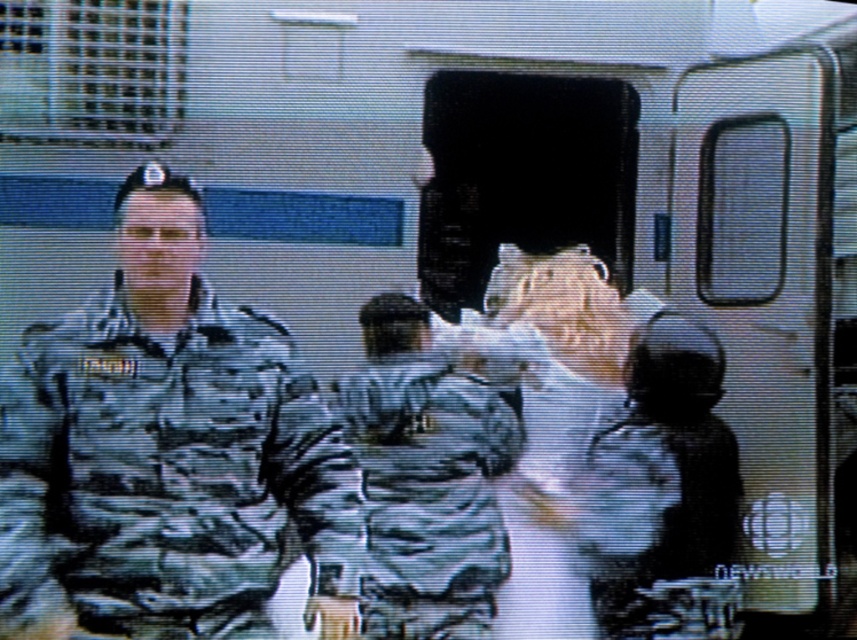
You are a drone operator trying to locate a specific point on the camo uniform at center in the image. The coordinates given are point (166, 451). Based on the scene description, can you confirm if this point is on the camo uniform at center?

Yes, the point (166, 451) is on the camo uniform at center as stated in the Objects Description.

You are a military analyst reviewing a CBC broadcast. You see two uniforms in the image, the camo uniform at center and the camouflage fabric uniform at lower right. Which one is covering part of the other?

The camo uniform at center is positioned over camouflage fabric uniform at lower right, meaning it is covering part of the latter.